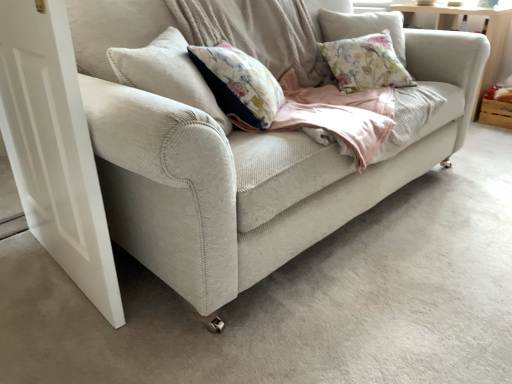
You are a GUI agent. You are given a task and a screenshot of the screen. Output one action in this format:
    pyautogui.click(x=<x>, y=<y>)
    Task: Click on the vacant region to the left of white matte door at left
    
    Given the screenshot: What is the action you would take?
    pyautogui.click(x=29, y=265)